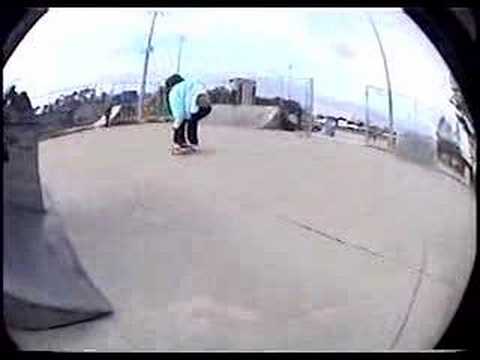
Find the location of a particular element. mirror is located at coordinates (339, 202).